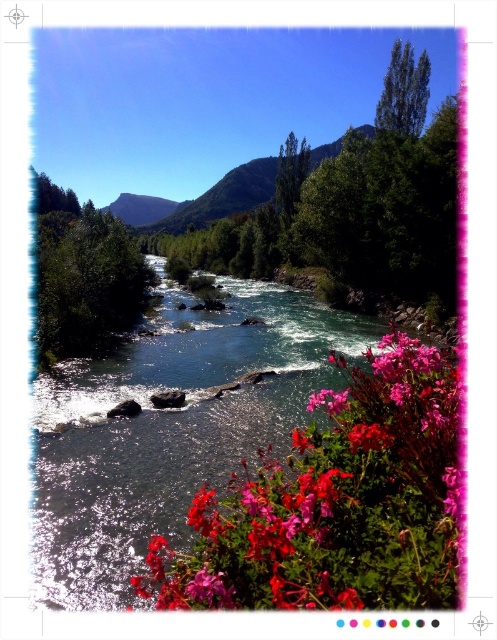
Question: Is vivid pink petals at lower right below green forested mountain at upper center?

Choices:
 (A) no
 (B) yes

Answer: (B)

Question: Which point is closer to the camera?

Choices:
 (A) vivid pink petals at lower right
 (B) green forested mountain at upper center

Answer: (A)

Question: Is vivid pink petals at lower right positioned behind green forested mountain at upper center?

Choices:
 (A) yes
 (B) no

Answer: (B)

Question: Which object appears farthest from the camera in this image?

Choices:
 (A) vivid pink petals at lower right
 (B) green forested mountain at upper center

Answer: (B)

Question: Which point appears closest to the camera in this image?

Choices:
 (A) (112, 202)
 (B) (163, 547)

Answer: (B)

Question: Is vivid pink petals at lower right to the left of green forested mountain at upper center from the viewer's perspective?

Choices:
 (A) no
 (B) yes

Answer: (A)